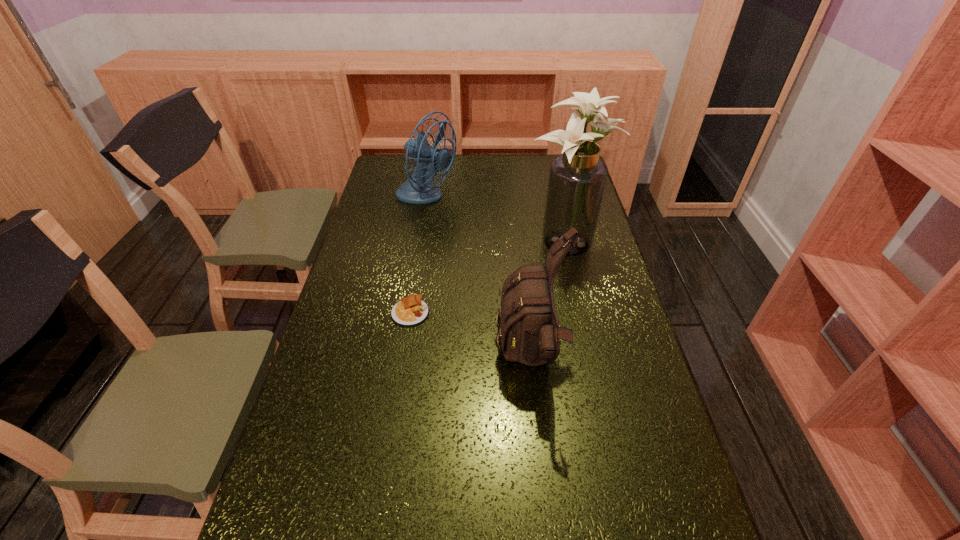
Find the location of a particular element. This screenshot has height=540, width=960. free space between the farthest object and the shortest object is located at coordinates (419, 255).

What are the coordinates of `free space between the farthest object and the shoulder bag` in the screenshot? It's located at (479, 279).

Where is `vacant region between the farthest object and the omelet`? vacant region between the farthest object and the omelet is located at coordinates (419, 255).

Where is `blank region between the farthest object and the third nearest object`? Image resolution: width=960 pixels, height=540 pixels. blank region between the farthest object and the third nearest object is located at coordinates (495, 221).

I want to click on vacant area between the tallest object and the shortest object, so click(x=487, y=277).

Where is `unoccupied area between the fan and the shortest object`? unoccupied area between the fan and the shortest object is located at coordinates (419, 255).

Point out which object is positioned as the nearest to the shoulder bag. Please provide its 2D coordinates. Your answer should be formatted as a tuple, i.e. [(x, y)], where the tuple contains the x and y coordinates of a point satisfying the conditions above.

[(411, 311)]

Identify which object is the third nearest to the shoulder bag. Please provide its 2D coordinates. Your answer should be formatted as a tuple, i.e. [(x, y)], where the tuple contains the x and y coordinates of a point satisfying the conditions above.

[(415, 190)]

At what (x,y) coordinates should I click in order to perform the action: click on free spot that satisfies the following two spatial constraints: 1. on the back side of the omelet; 2. on the left side of the flower arrangement. Please return your answer as a coordinate pair (x, y). Looking at the image, I should click on (421, 243).

Where is `free location that satisfies the following two spatial constraints: 1. in front of the fan to blow air; 2. on the back side of the omelet`? Image resolution: width=960 pixels, height=540 pixels. free location that satisfies the following two spatial constraints: 1. in front of the fan to blow air; 2. on the back side of the omelet is located at coordinates (408, 312).